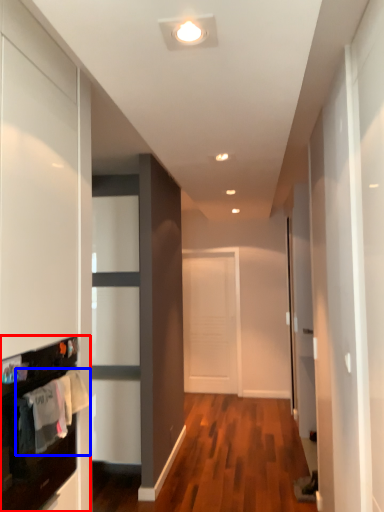
Question: Which object appears closest to the camera in this image, cabinetry (highlighted by a red box) or laundry (highlighted by a blue box)?

Choices:
 (A) cabinetry
 (B) laundry

Answer: (A)